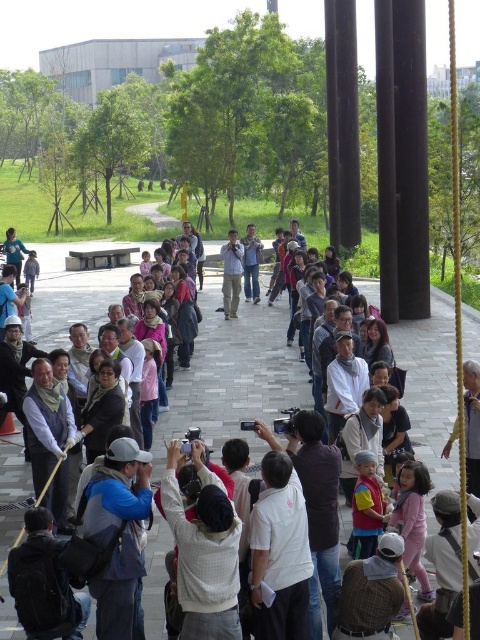
At what (x,y) coordinates should I click in order to perform the action: click on white matte shirt at center. Please return your answer as a coordinate pair (x, y). Looking at the image, I should click on (279, 554).

Is white matte shirt at center positioned before light brown leather vest at center?

Yes, white matte shirt at center is in front of light brown leather vest at center.

Which is in front, point (263, 637) or point (48, 474)?

Point (263, 637)

Identify the location of white matte shirt at center. click(x=279, y=554).

Does point (171, 483) come closer to viewer compared to point (274, 468)?

Yes.

Who is more forward, (226,506) or (262,595)?

Point (226,506)

Is point (186, 564) positioned after point (276, 476)?

No, it is not.

At what (x,y) coordinates should I click in order to perform the action: click on white cotton shirt at center. Please return your answer as a coordinate pair (x, y). The width and height of the screenshot is (480, 640). Looking at the image, I should click on (204, 550).

Is point (109, 500) more distant than point (274, 627)?

Yes, it is behind point (274, 627).

Is point (105, 506) farther from camera compared to point (267, 460)?

No, it is not.

You are a GUI agent. You are given a task and a screenshot of the screen. Output one action in this format:
    pyautogui.click(x=<x>, y=<y>)
    Task: Click on the blue fabric backpack at center
    The height and width of the screenshot is (640, 480).
    Given the screenshot: What is the action you would take?
    pyautogui.click(x=120, y=536)